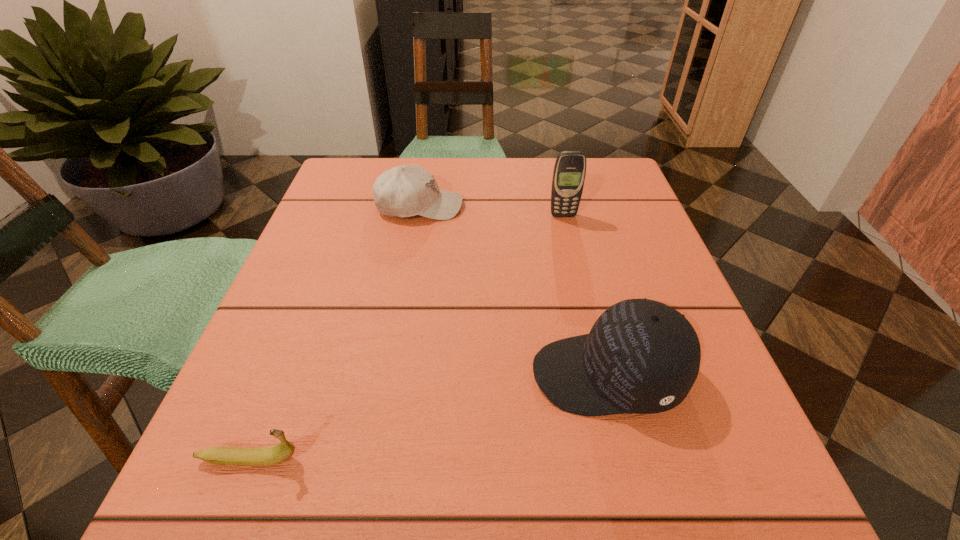
Identify the location of the tallest object. (569, 172).

This screenshot has width=960, height=540. I want to click on the third shortest object, so click(641, 356).

The width and height of the screenshot is (960, 540). In order to click on the second nearest object in this screenshot , I will do `click(641, 356)`.

This screenshot has width=960, height=540. Find the location of `the left baseball cap`. the left baseball cap is located at coordinates (407, 190).

I want to click on the farther baseball cap, so click(407, 190).

Where is `the shortest object`? the shortest object is located at coordinates (221, 455).

Where is `banana`? Image resolution: width=960 pixels, height=540 pixels. banana is located at coordinates 221,455.

Locate an element on the screen. The image size is (960, 540). free space located on the screen of the tallest object is located at coordinates (582, 294).

The height and width of the screenshot is (540, 960). I want to click on vacant space located at the front of the third farthest object where the brim is located, so click(424, 375).

At what (x,y) coordinates should I click in order to perform the action: click on free space located 0.300m at the front of the third farthest object where the brim is located. Please return your answer as a coordinate pair (x, y). The width and height of the screenshot is (960, 540). Looking at the image, I should click on (329, 375).